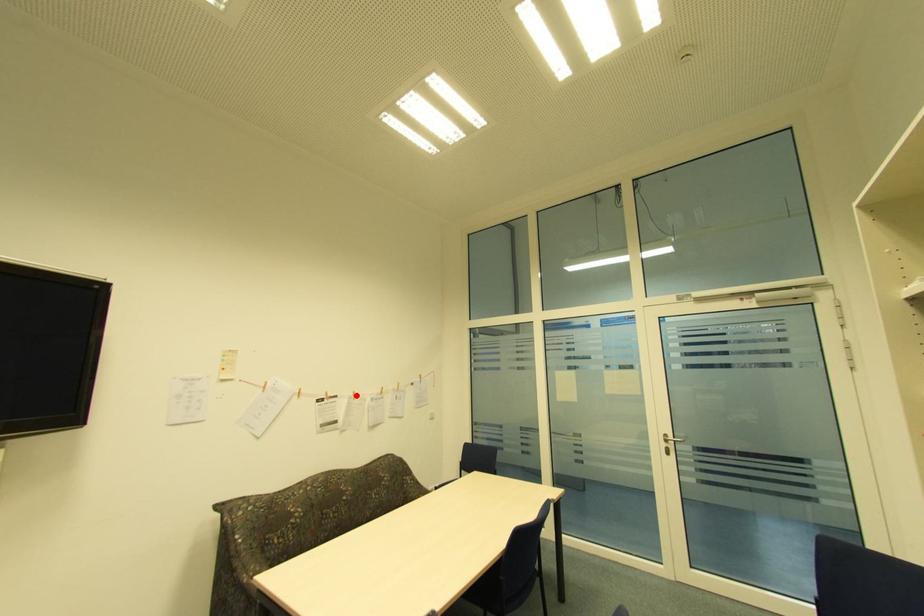
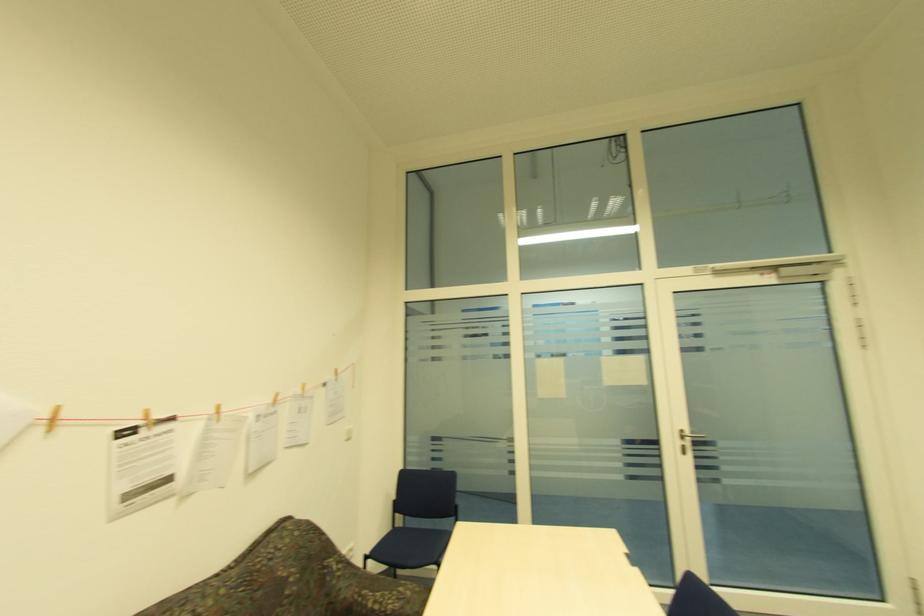
In the second image, find the point that corresponds to the highlighted location in the first image.

(219, 413)